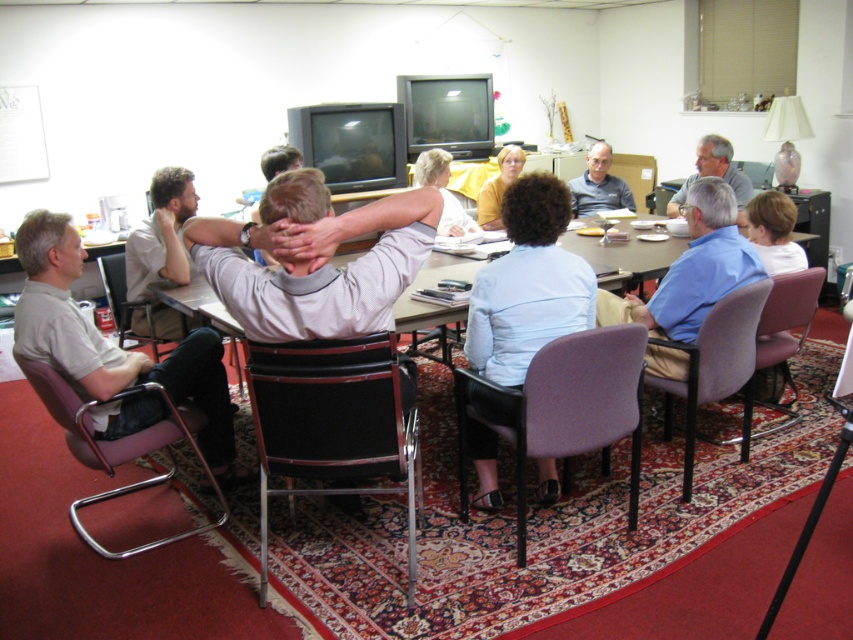
Does light gray fabric shirt at left lie in front of purple fabric chair at lower right?

Yes, light gray fabric shirt at left is closer to the viewer.

Does light gray fabric shirt at left have a smaller size compared to purple fabric chair at lower right?

No.

The width and height of the screenshot is (853, 640). Identify the location of light gray fabric shirt at left. (115, 349).

Identify the location of light gray fabric shirt at left. This screenshot has height=640, width=853. (115, 349).

Which is more to the right, blue shirt at center or purple fabric chair at lower right?

Positioned to the right is blue shirt at center.

Based on the photo, is blue shirt at center to the right of purple fabric chair at lower right from the viewer's perspective?

Yes, blue shirt at center is to the right of purple fabric chair at lower right.

Does point (694, 193) come behind point (660, 342)?

Yes, it is behind point (660, 342).

I want to click on blue shirt at center, so click(x=692, y=269).

Is gray matte sweater at center thinner than purple plastic chair at lower right?

Yes, gray matte sweater at center is thinner than purple plastic chair at lower right.

Is point (233, 310) positioned after point (787, 323)?

No, it is in front of (787, 323).

The height and width of the screenshot is (640, 853). I want to click on gray matte sweater at center, so click(x=314, y=260).